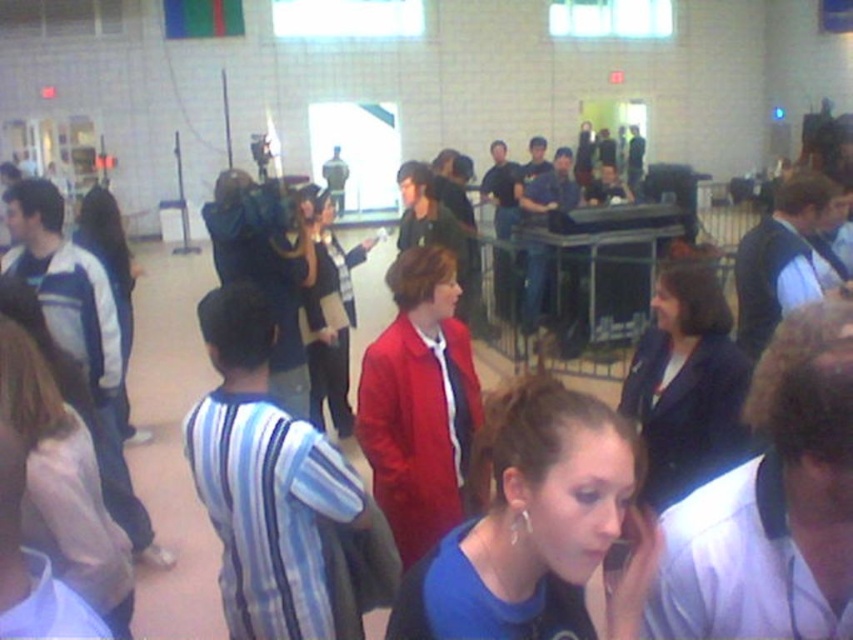
Is light pink fabric blouse at lower left to the right of white fleece jacket at left from the viewer's perspective?

Correct, you'll find light pink fabric blouse at lower left to the right of white fleece jacket at left.

Measure the distance between light pink fabric blouse at lower left and camera.

They are 1.86 meters apart.

Find the location of a particular element. The width and height of the screenshot is (853, 640). light pink fabric blouse at lower left is located at coordinates (62, 483).

Does matte red coat at center lie in front of white fleece jacket at left?

Yes, matte red coat at center is in front of white fleece jacket at left.

Consider the image. Can you confirm if matte red coat at center is wider than white fleece jacket at left?

Correct, the width of matte red coat at center exceeds that of white fleece jacket at left.

Where is `matte red coat at center`? The width and height of the screenshot is (853, 640). matte red coat at center is located at coordinates pyautogui.click(x=419, y=403).

Based on the photo, is matte red coat at center to the right of light pink fabric blouse at lower left from the viewer's perspective?

Yes, matte red coat at center is to the right of light pink fabric blouse at lower left.

Between matte red coat at center and light pink fabric blouse at lower left, which one is positioned lower?

light pink fabric blouse at lower left

The width and height of the screenshot is (853, 640). Identify the location of matte red coat at center. (419, 403).